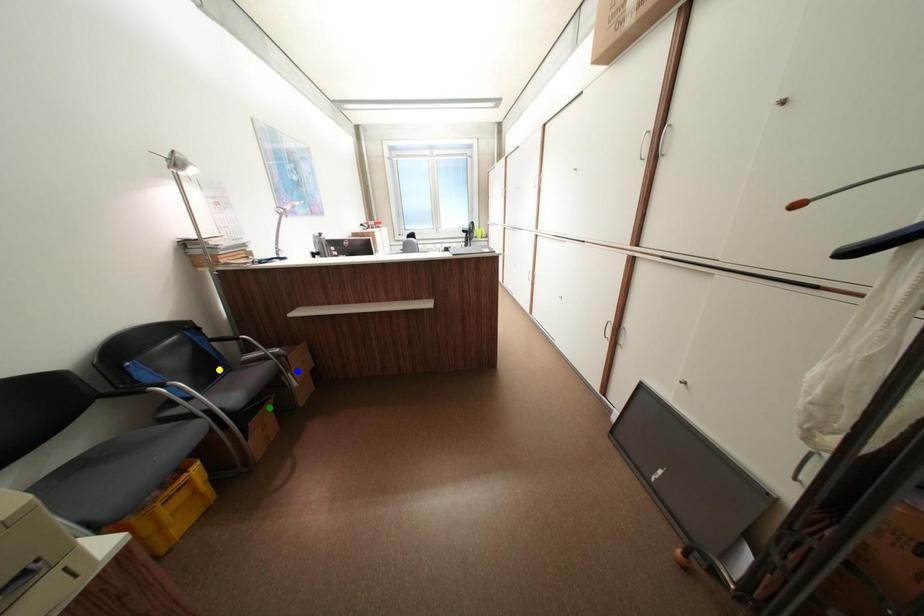
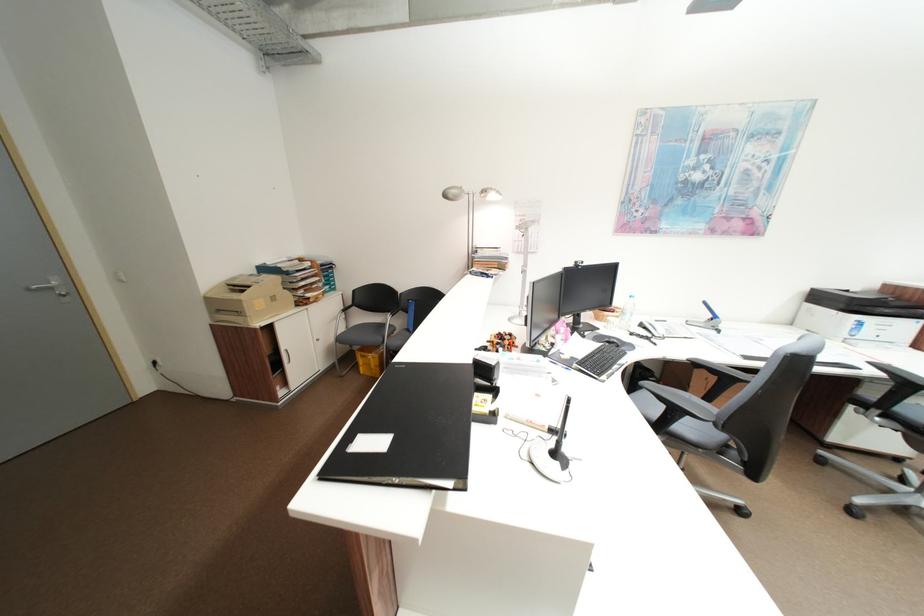
I am providing you with two images of the same scene from different viewpoints. Three points are marked in image1. Which point corresponds to a part or object that is occluded in image2?In image1, three points are marked. Which of them correspond to a part or object that is occluded in image2?Among the three points shown in image1, which one corresponds to a part or object that is no longer visible due to occlusion in image2?

blue point, green point, yellow point cannot be seen in image2.